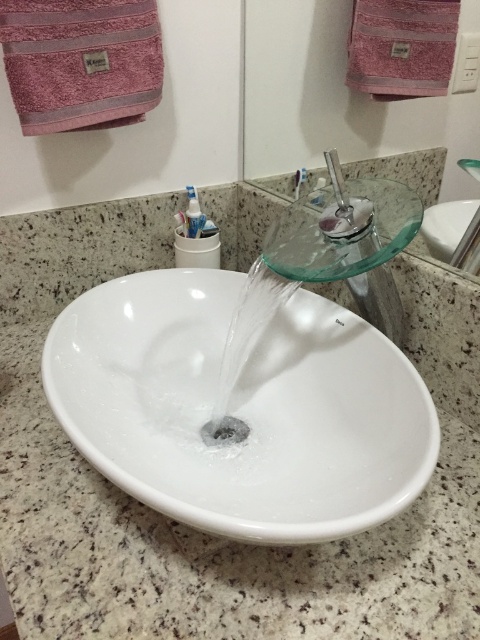
Question: Observing the image, what is the correct spatial positioning of transparent glass faucet at center in reference to white glossy toothpaste at upper center?

Choices:
 (A) below
 (B) above

Answer: (A)

Question: From the image, what is the correct spatial relationship of white glossy sink at center in relation to transparent glass faucet at center?

Choices:
 (A) above
 (B) below

Answer: (B)

Question: Which point is closer to the camera taking this photo?

Choices:
 (A) (189, 228)
 (B) (298, 272)
 (C) (78, 388)

Answer: (B)

Question: Is transparent glass faucet at center bigger than white glossy toothpaste at upper center?

Choices:
 (A) yes
 (B) no

Answer: (A)

Question: Estimate the real-world distances between objects in this image. Which object is farther from the white glossy toothpaste at upper center?

Choices:
 (A) black metallic drain at center
 (B) transparent glass faucet at center

Answer: (A)

Question: Among these objects, which one is nearest to the camera?

Choices:
 (A) transparent glass faucet at center
 (B) white glossy sink at center

Answer: (B)